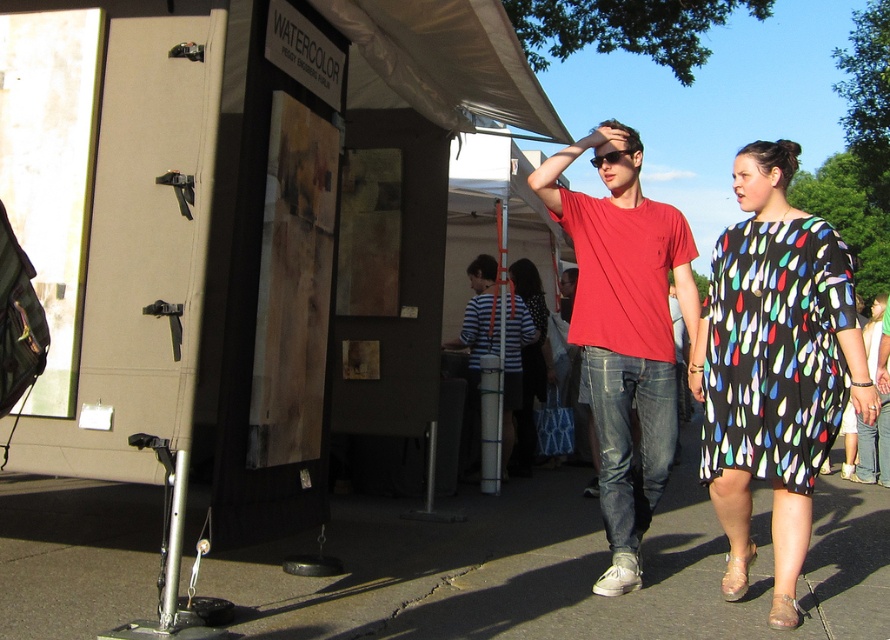
Is point (733, 628) positioned in front of point (781, 355)?

Yes, it is.

Can you confirm if gray asphalt pavement at center is wider than black printed dress at right?

Correct, the width of gray asphalt pavement at center exceeds that of black printed dress at right.

Measure the distance between point (236, 605) and camera.

They are 3.90 meters apart.

This screenshot has height=640, width=890. What are the coordinates of `gray asphalt pavement at center` in the screenshot? It's located at (557, 568).

Does point (515, 396) come closer to viewer compared to point (524, 429)?

Yes, point (515, 396) is closer to viewer.

Based on the photo, does striped fabric shirt at center appear over striped fabric dress at center?

Correct, striped fabric shirt at center is located above striped fabric dress at center.

Find the location of `striped fabric shirt at center`. striped fabric shirt at center is located at coordinates (x=479, y=317).

In order to click on striped fabric shirt at center in this screenshot , I will do `click(479, 317)`.

From the picture: Who is taller, matte red t-shirt at center or striped fabric shirt at center?

Standing taller between the two is matte red t-shirt at center.

This screenshot has height=640, width=890. Describe the element at coordinates (624, 330) in the screenshot. I see `matte red t-shirt at center` at that location.

Which is in front, point (672, 394) or point (483, 346)?

Point (672, 394) is more forward.

You are a GUI agent. You are given a task and a screenshot of the screen. Output one action in this format:
    pyautogui.click(x=<x>, y=<y>)
    Task: Click on the matte red t-shirt at center
    The image size is (890, 640).
    Given the screenshot: What is the action you would take?
    pyautogui.click(x=624, y=330)